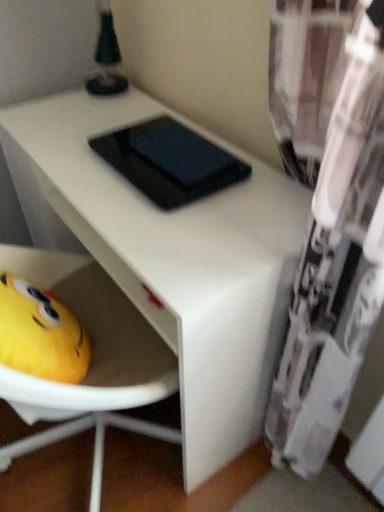
At what (x,y) coordinates should I click in order to perform the action: click on free point above white matte table at center (from a real-world perspective). Please return your answer as a coordinate pair (x, y). Image resolution: width=384 pixels, height=512 pixels. Looking at the image, I should click on (144, 174).